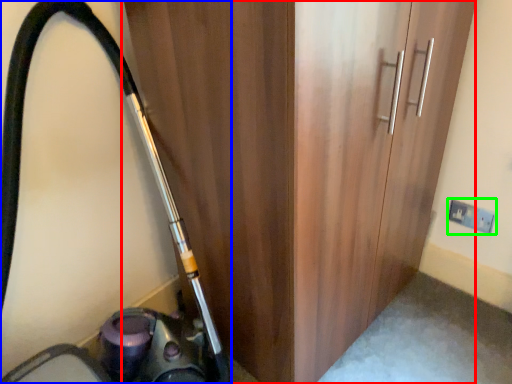
Question: Based on their relative distances, which object is nearer to door (highlighted by a red box)? Choose from equipment (highlighted by a blue box) and electric outlet (highlighted by a green box).

Choices:
 (A) equipment
 (B) electric outlet

Answer: (A)